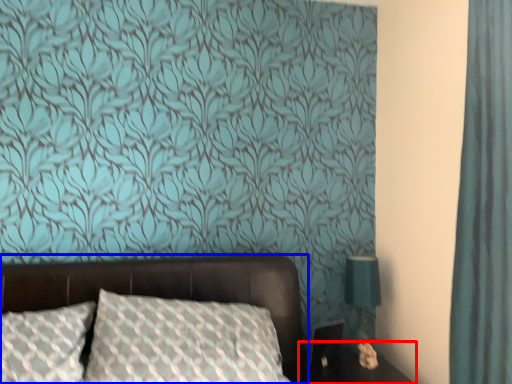
Question: Among these objects, which one is nearest to the camera, table (highlighted by a red box) or bed (highlighted by a blue box)?

Choices:
 (A) table
 (B) bed

Answer: (B)